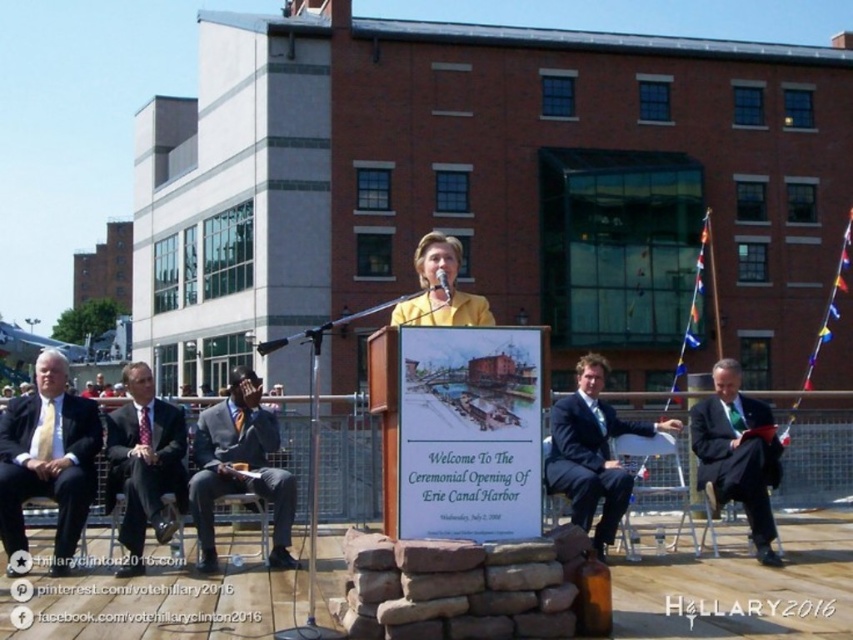
You are attending the Erie Canal Harbor opening ceremony and notice two attendees dressed in formal attire. The first has a matte gold tie at left, and the second is wearing a dark blue suit at center. From your perspective as an attendee facing the stage, which of these two is positioned more to the left side?

The matte gold tie at left is positioned more to the left side compared to the dark blue suit at center.

Based on the photo, you are an event photographer positioned at the back of the crowd. You want to take a photo of the dark blue suit at center and the dark suit at center. Can you see both subjects clearly in your frame without any obstruction?

The dark blue suit at center is in front of the dark suit at center, so the dark blue suit at center may block the view of the dark suit at center behind it, making it difficult to capture both clearly in the photo.